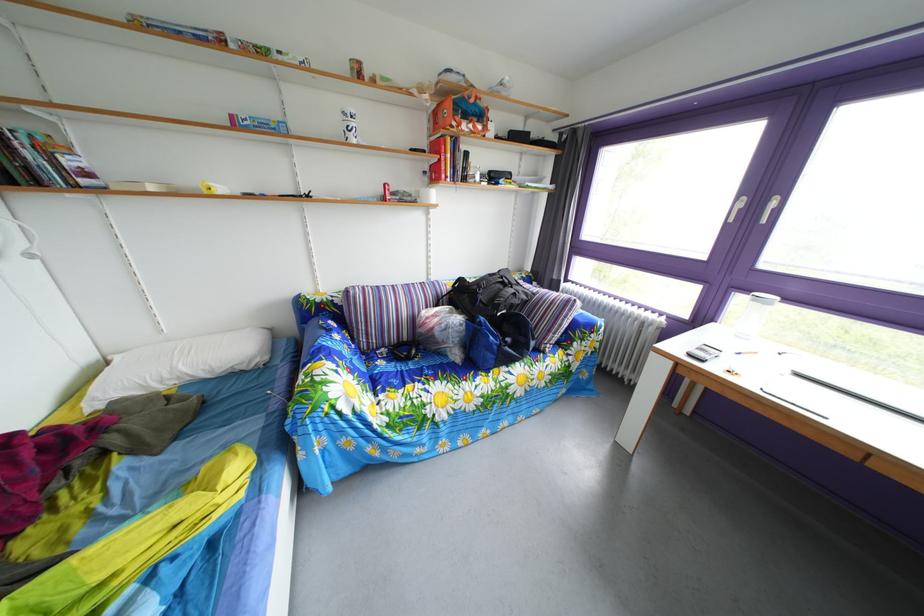
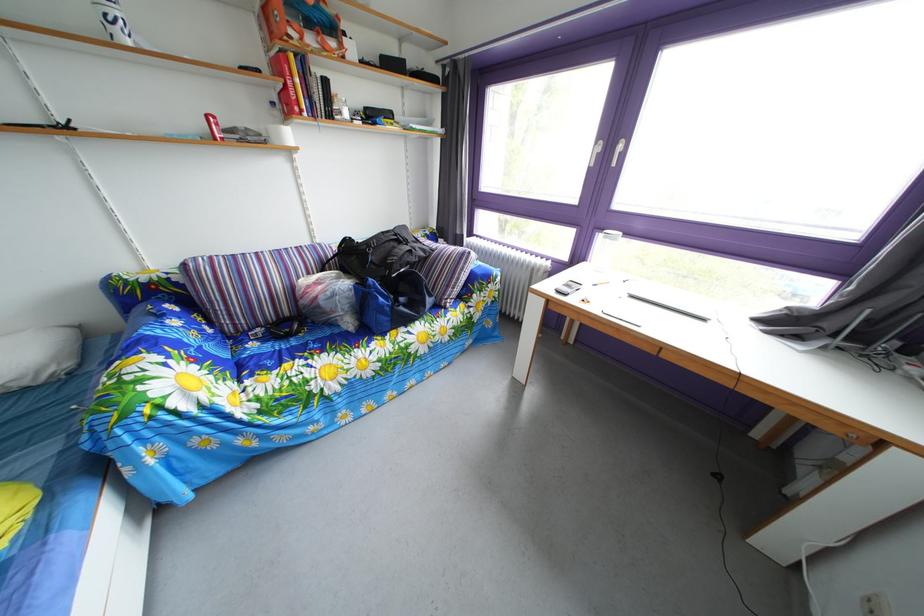
Question: The camera is either moving clockwise (left) or counter-clockwise (right) around the object. The first image is from the beginning of the video and the second image is from the end. Is the camera moving left or right when shooting the video?

Choices:
 (A) Left
 (B) Right

Answer: (A)